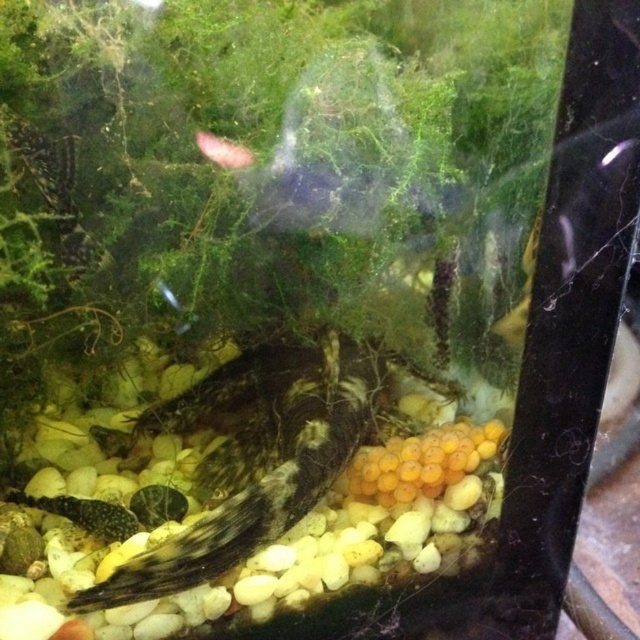
Question: Which of the following is the closest to the observer?

Choices:
 (A) pink translucent fish at upper center
 (B) speckled brown fish at center

Answer: (B)

Question: Does speckled brown fish at center come behind pink translucent fish at upper center?

Choices:
 (A) yes
 (B) no

Answer: (B)

Question: Can you confirm if speckled brown fish at center is thinner than pink translucent fish at upper center?

Choices:
 (A) yes
 (B) no

Answer: (B)

Question: Does speckled brown fish at center have a smaller size compared to pink translucent fish at upper center?

Choices:
 (A) yes
 (B) no

Answer: (B)